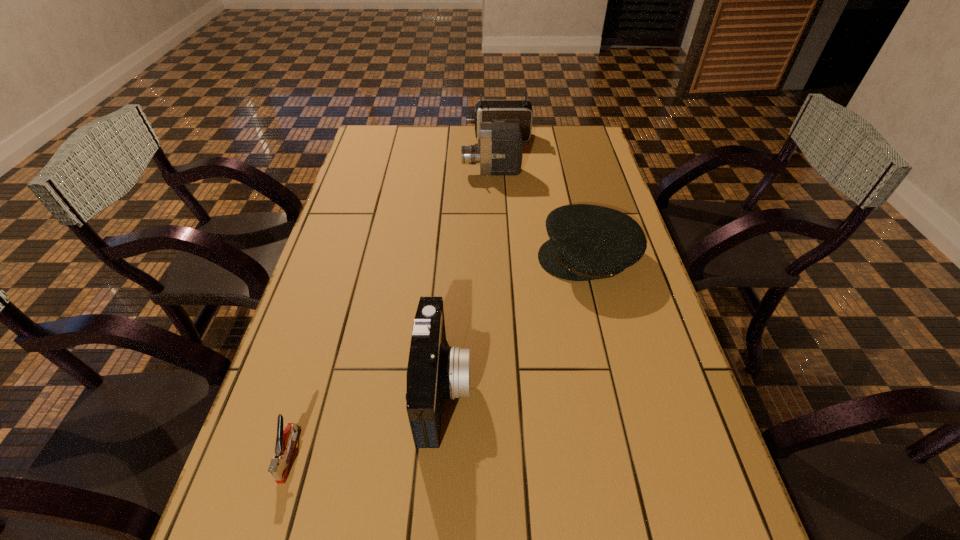
Identify the location of the farthest object. (513, 111).

Where is `the second farthest object`? Image resolution: width=960 pixels, height=540 pixels. the second farthest object is located at coordinates (500, 150).

The width and height of the screenshot is (960, 540). I want to click on the nearest camcorder, so click(x=435, y=372).

Locate an element on the screen. The width and height of the screenshot is (960, 540). the second shortest object is located at coordinates (587, 242).

What are the coordinates of `beret` in the screenshot? It's located at (587, 242).

Where is `stapler`? The image size is (960, 540). stapler is located at coordinates (285, 441).

Find the location of a particular element. The width and height of the screenshot is (960, 540). the leftmost object is located at coordinates (285, 441).

At what (x,y) coordinates should I click in order to perform the action: click on vacant space located at the lens of the farthest object. Please return your answer as a coordinate pair (x, y). This screenshot has width=960, height=540. Looking at the image, I should click on point(414,138).

Where is `free point located 0.120m at the lens of the farthest object`? This screenshot has width=960, height=540. free point located 0.120m at the lens of the farthest object is located at coordinates (436, 138).

Identify the location of free space located at the lens of the farthest object. This screenshot has width=960, height=540. (369, 138).